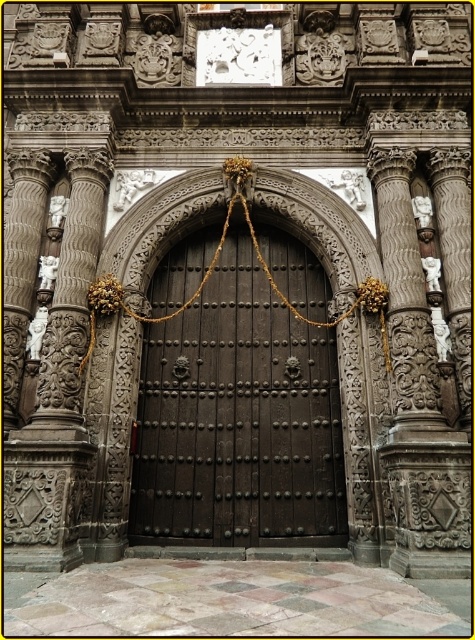
Does dark wood door at center appear on the left side of gold rope at center?

Correct, you'll find dark wood door at center to the left of gold rope at center.

Is point (246, 294) closer to viewer compared to point (370, 288)?

No, it is behind (370, 288).

What are the coordinates of `dark wood door at center` in the screenshot? It's located at (237, 419).